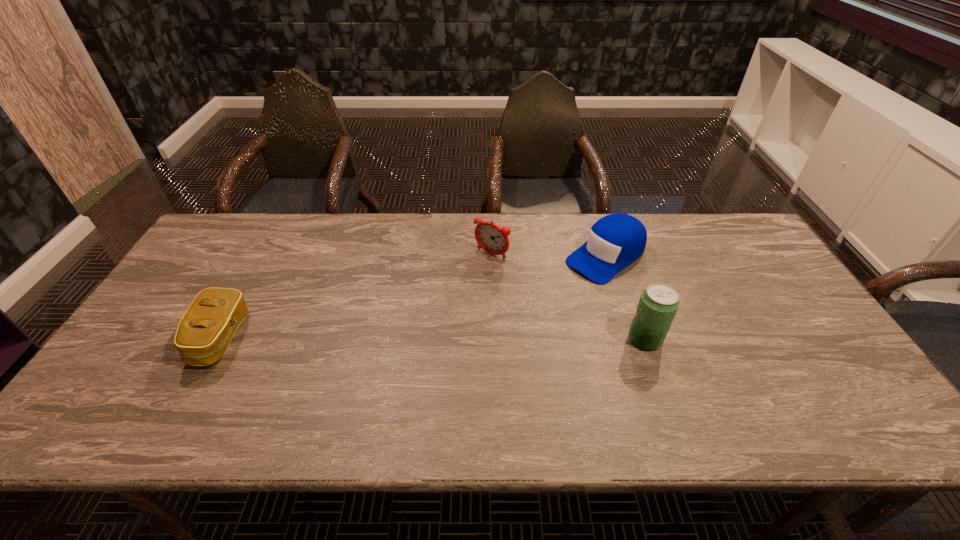
The height and width of the screenshot is (540, 960). Identify the location of free space on the desktop that is between the leftmost object and the soda and is positioned on the front-facing side of the baseball cap. (489, 339).

Identify the location of vacant space on the desktop that is between the leftmost object and the soda and is positioned on the front-facing side of the second object from left to right. This screenshot has width=960, height=540. (415, 339).